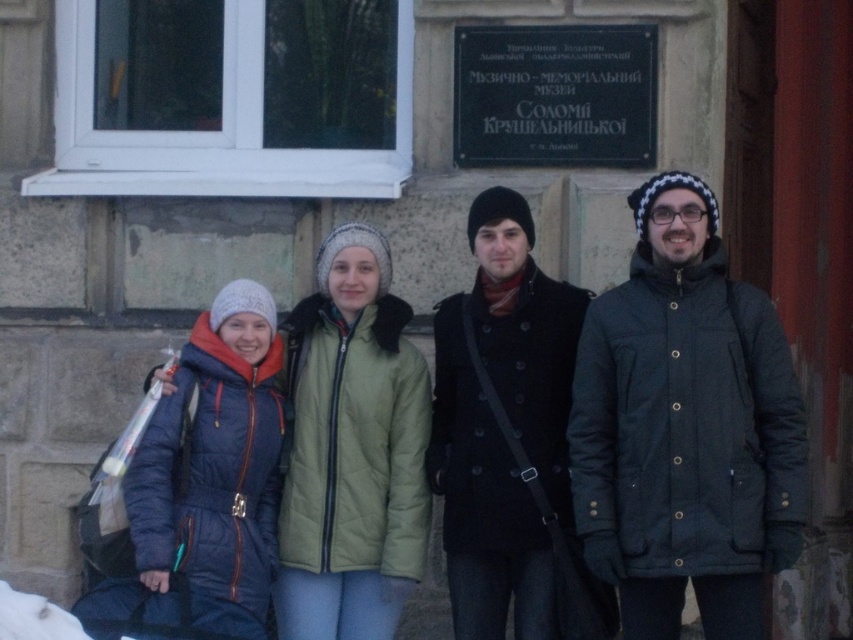
Question: Is dark gray quilted jacket at center thinner than green quilted jacket at center?

Choices:
 (A) no
 (B) yes

Answer: (A)

Question: Considering the relative positions of dark wool coat at center and matte blue snowsuit at lower left in the image provided, where is dark wool coat at center located with respect to matte blue snowsuit at lower left?

Choices:
 (A) left
 (B) right

Answer: (B)

Question: Does dark gray quilted jacket at center appear on the left side of matte blue snowsuit at lower left?

Choices:
 (A) yes
 (B) no

Answer: (B)

Question: Based on their relative distances, which object is farther from the matte blue snowsuit at lower left?

Choices:
 (A) green quilted jacket at center
 (B) dark gray quilted jacket at center
 (C) dark wool coat at center

Answer: (B)

Question: Which of the following is the farthest from the observer?

Choices:
 (A) dark gray quilted jacket at center
 (B) matte blue snowsuit at lower left
 (C) green quilted jacket at center
 (D) dark wool coat at center

Answer: (C)

Question: Which point is farther to the camera?

Choices:
 (A) dark gray quilted jacket at center
 (B) green quilted jacket at center
 (C) matte blue snowsuit at lower left
 (D) dark wool coat at center

Answer: (B)